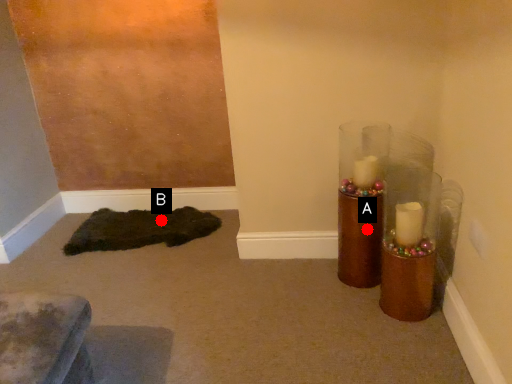
Question: Two points are circled on the image, labeled by A and B beside each circle. Which point is closer to the camera?

Choices:
 (A) A is closer
 (B) B is closer

Answer: (A)